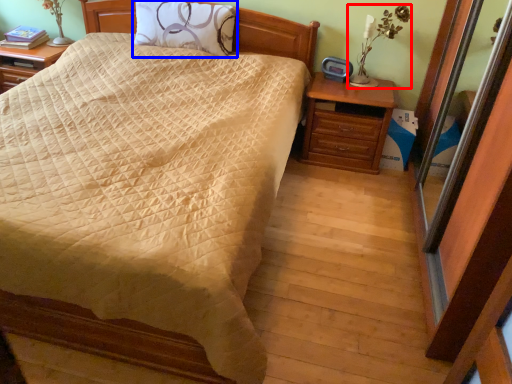
Question: Among these objects, which one is farthest to the camera, table lamp (highlighted by a red box) or pillow (highlighted by a blue box)?

Choices:
 (A) table lamp
 (B) pillow

Answer: (B)